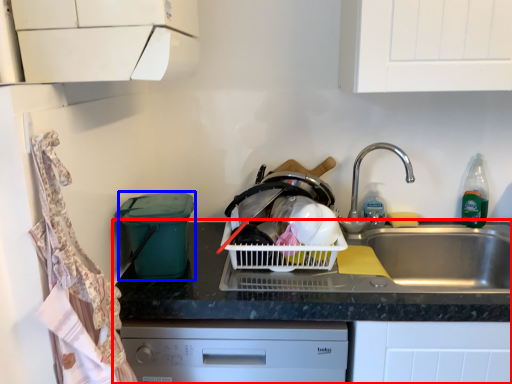
Question: Among these objects, which one is nearest to the camera, countertop (highlighted by a red box) or appliance (highlighted by a blue box)?

Choices:
 (A) countertop
 (B) appliance

Answer: (A)